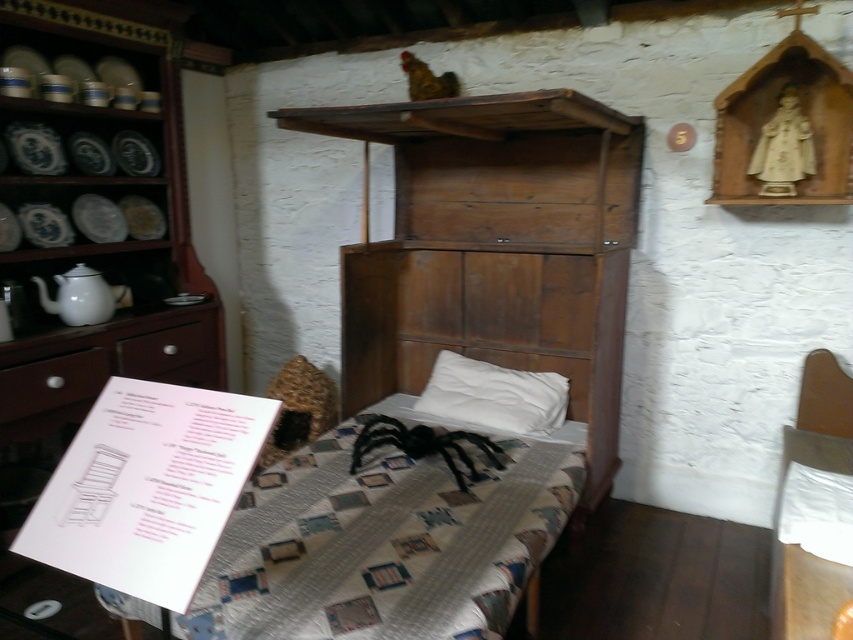
You are standing in the room and want to place a small plant between the wooden bed frame at center and the matte white drawer at lower left. Based on their positions, which object should the plant be closer to?

The wooden bed frame at center is closer to the viewer than the matte white drawer at lower left, so the plant should be placed closer to the matte white drawer at lower left to maintain equal distance from both objects.

You are standing in the room and want to move from point A to point B. Point A is at coordinates point [541,518] and point B is at coordinates point [138,340]. Which point is closer to you when you first enter the room?

Point [541,518] is closer to the viewer than point [138,340], so point A is closer when you first enter the room.